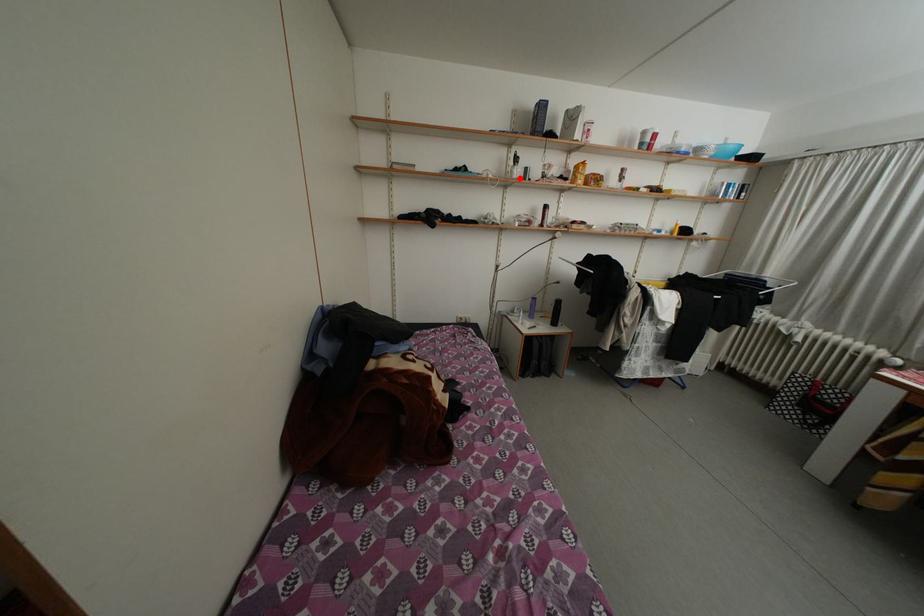
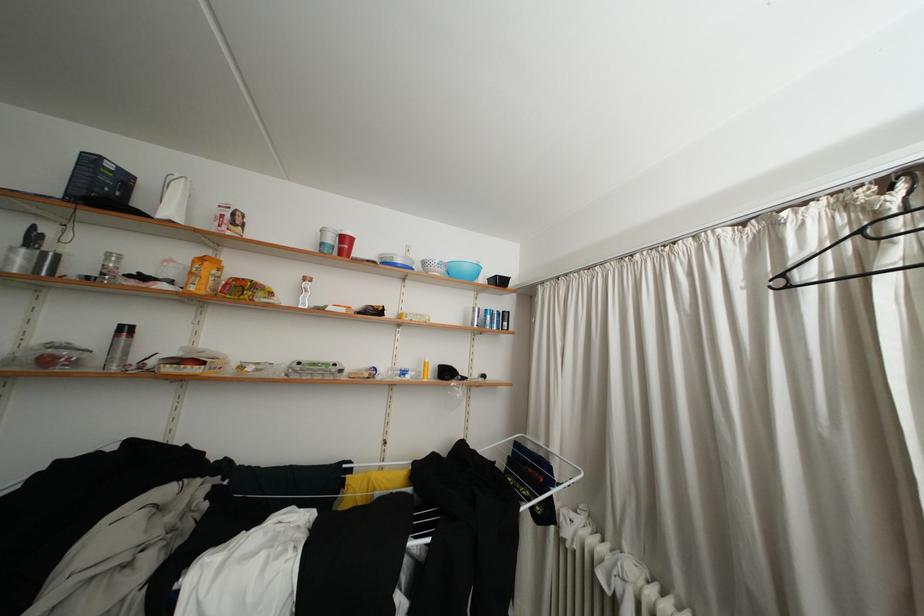
In the second image, find the point that corresponds to the highlighted location in the first image.

(17, 264)